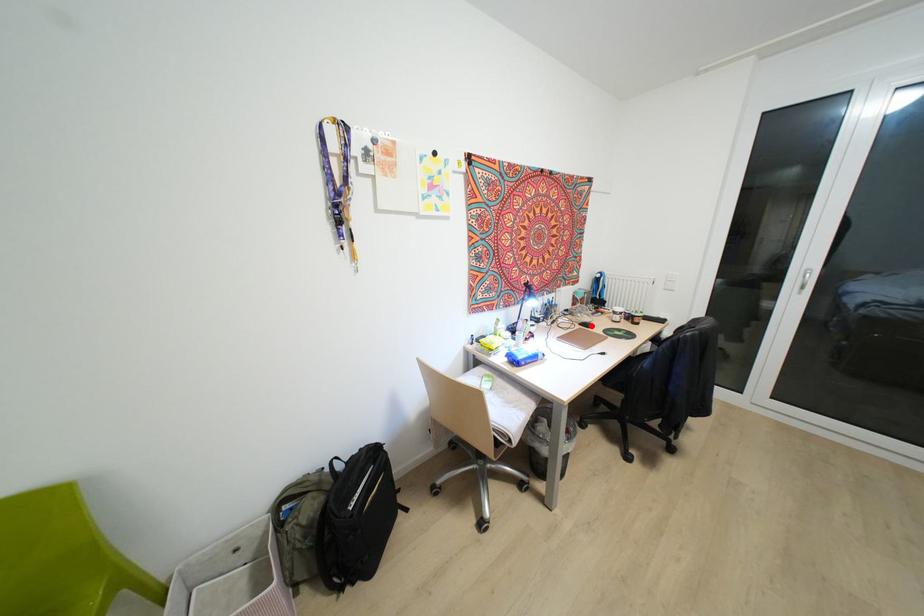
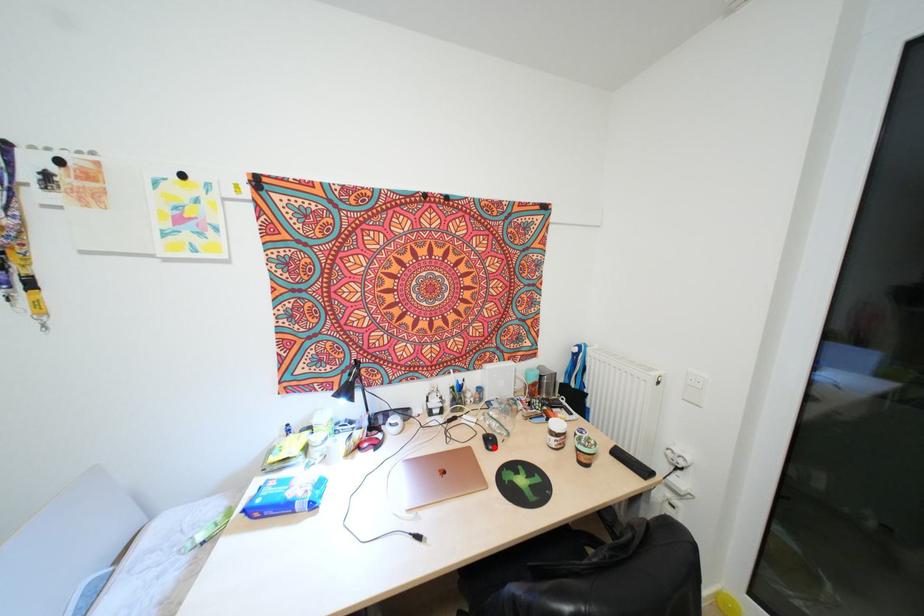
I am providing you with two images of the same scene from different viewpoints. A red point is marked on the first image and another point is marked on the second image. Is the marked point in image1 the same physical position as the marked point in image2?

Yes